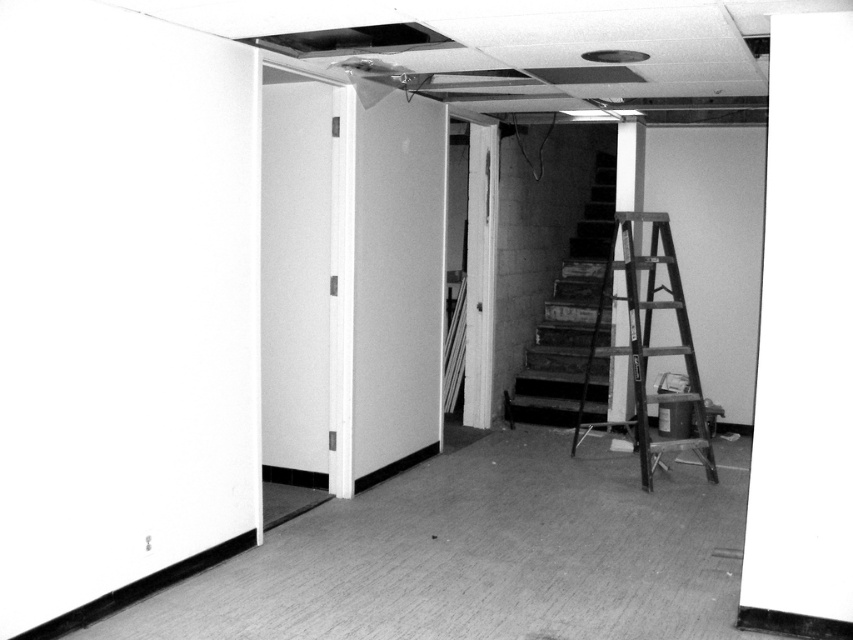
You are standing in the center of the room and want to move towards the staircase in the background. Which point, point (349, 577) or point (685, 358), is closer to your current position?

Point (349, 577) is closer to the viewer than point (685, 358), so it is closer to your current position.

You are standing in the center of the room and want to reach the wooden at right. Which direction should you move to get closer to it?

Since the wooden at right is located at point 0.544 on the x and 0.761 on the y, you should move to the right and slightly forward to reach it.

In the scene shown: You are standing at the entrance of the room and want to walk to the smooth carpet at lower center. According to the coordinates provided, in which direction should you move from your current position?

The smooth carpet at lower center is located at coordinates point (480, 556). Since you are at the entrance, you should move towards the lower center direction to reach it.